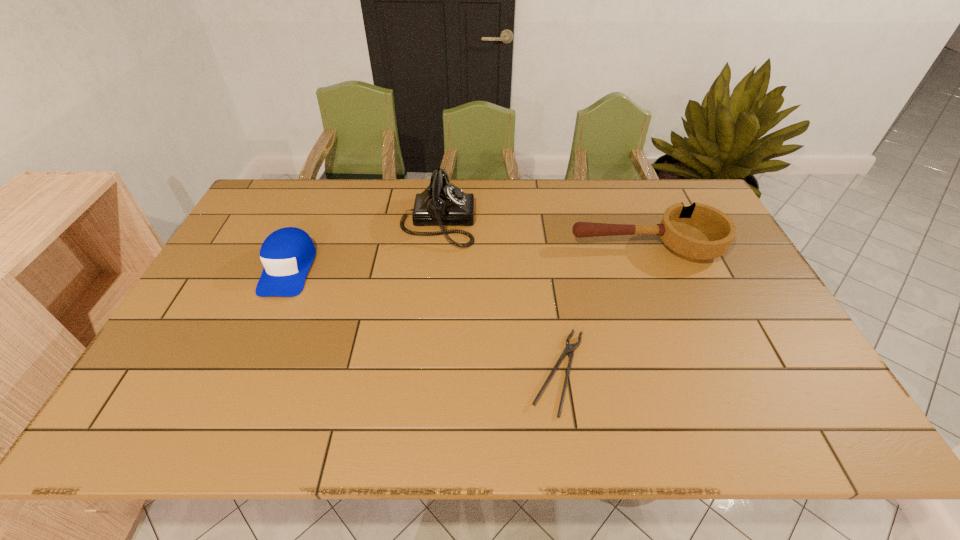
In order to click on free space located 0.250m with the handle on the side of the saucepan in this screenshot , I will do `click(488, 246)`.

Locate an element on the screen. vacant region located on the left of the third object from left to right is located at coordinates (451, 373).

This screenshot has height=540, width=960. What are the coordinates of `object that is at the far edge` in the screenshot? It's located at (441, 203).

Identify the location of object at the near edge. The width and height of the screenshot is (960, 540). (569, 349).

At what (x,y) coordinates should I click in order to perform the action: click on object situated at the left edge. Please return your answer as a coordinate pair (x, y). Image resolution: width=960 pixels, height=540 pixels. Looking at the image, I should click on (287, 254).

Identify the location of object that is positioned at the right edge. Image resolution: width=960 pixels, height=540 pixels. (697, 232).

The image size is (960, 540). What are the coordinates of `vacant area at the far edge of the desktop` in the screenshot? It's located at (647, 206).

In the image, there is a desktop. At what (x,y) coordinates should I click in order to perform the action: click on vacant space at the near edge. Please return your answer as a coordinate pair (x, y). This screenshot has height=540, width=960. Looking at the image, I should click on (660, 412).

I want to click on vacant position at the right edge of the desktop, so click(746, 291).

This screenshot has height=540, width=960. What are the coordinates of `free spot at the far left corner of the desktop` in the screenshot? It's located at (281, 216).